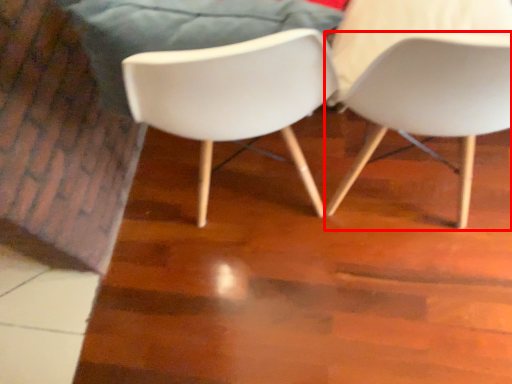
Question: From the image's perspective, considering the relative positions of chair (annotated by the red box) and chair in the image provided, where is chair (annotated by the red box) located with respect to the staircase?

Choices:
 (A) above
 (B) below

Answer: (B)